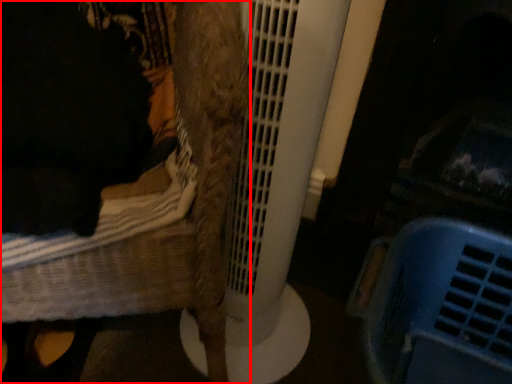
Question: From the image, what is the correct spatial relationship of furniture (annotated by the red box) in relation to basket?

Choices:
 (A) left
 (B) right

Answer: (A)